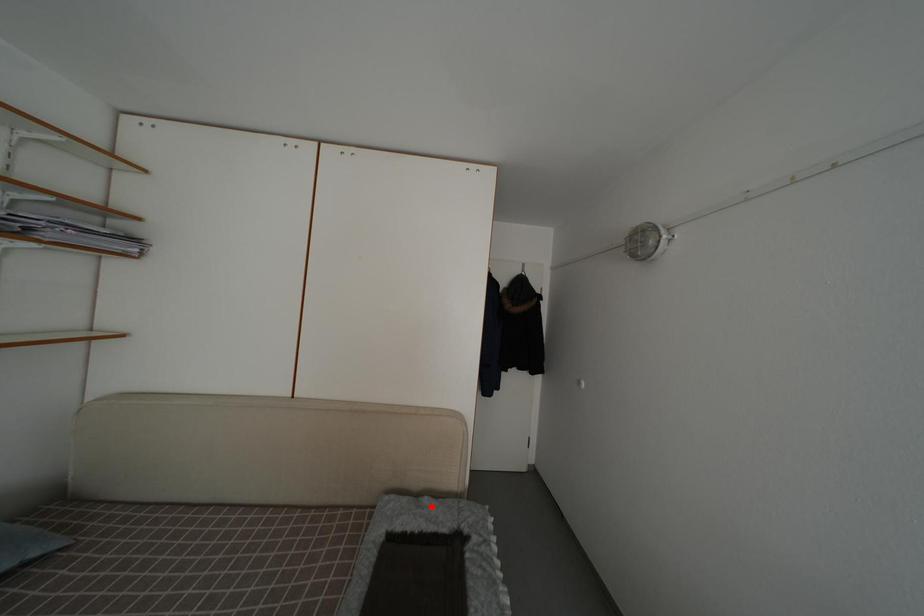
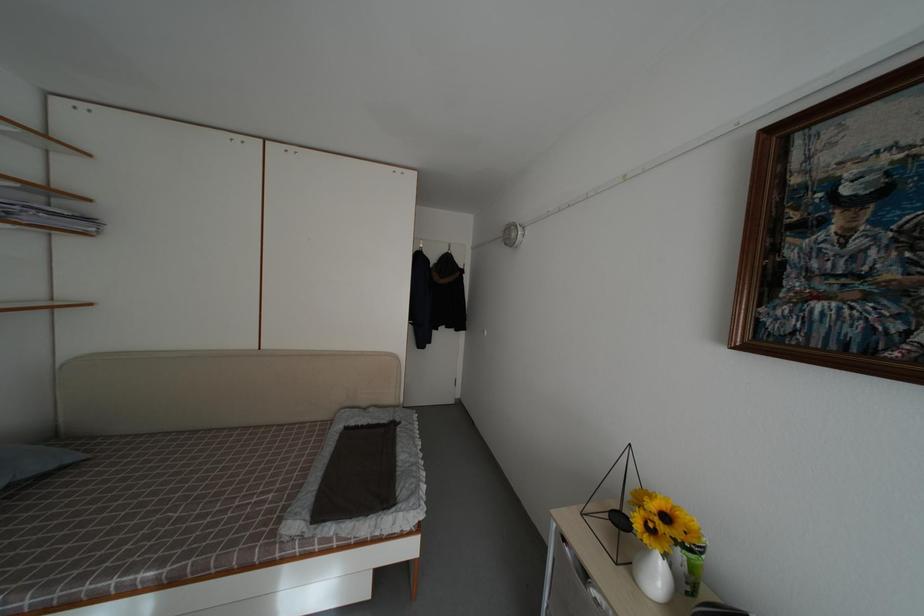
The point at the highlighted location is marked in the first image. Where is the corresponding point in the second image?

(378, 416)